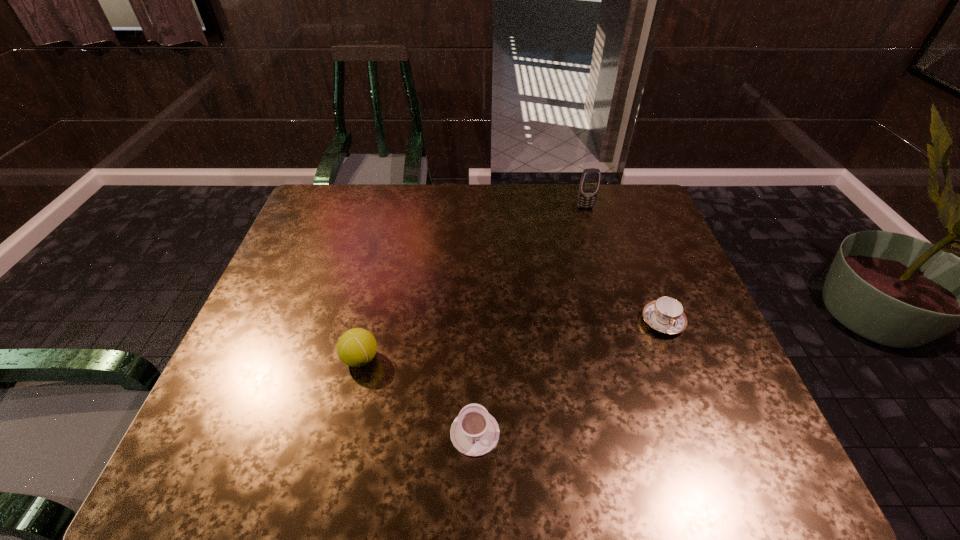
At what (x,y) coordinates should I click in order to perform the action: click on empty space that is in between the farther teacup and the tallest object. Please return your answer as a coordinate pair (x, y). Looking at the image, I should click on pos(624,265).

The image size is (960, 540). I want to click on free space between the tennis ball and the tallest object, so click(473, 283).

Identify the location of unoccupied position between the left teacup and the leftmost object. (418, 396).

This screenshot has height=540, width=960. What are the coordinates of `free point between the tennis ball and the farther teacup` in the screenshot? It's located at (512, 340).

You are a GUI agent. You are given a task and a screenshot of the screen. Output one action in this format:
    pyautogui.click(x=<x>, y=<y>)
    Task: Click on the free area in between the tennis ball and the third object from left to right
    This screenshot has height=540, width=960.
    Given the screenshot: What is the action you would take?
    click(x=473, y=283)

What are the coordinates of `free space between the leftmost object and the second farthest object` in the screenshot? It's located at (512, 340).

The width and height of the screenshot is (960, 540). What are the coordinates of `free space between the third nearest object and the tallest object` in the screenshot? It's located at (624, 265).

Find the location of a particular element. Image resolution: width=960 pixels, height=540 pixels. free space that is in between the leftmost object and the third nearest object is located at coordinates (512, 340).

The height and width of the screenshot is (540, 960). What are the coordinates of `empty location between the cellular telephone and the left teacup` in the screenshot? It's located at (530, 320).

Identify which object is the closest to the third object from right to left. Please provide its 2D coordinates. Your answer should be formatted as a tuple, i.e. [(x, y)], where the tuple contains the x and y coordinates of a point satisfying the conditions above.

[(356, 347)]